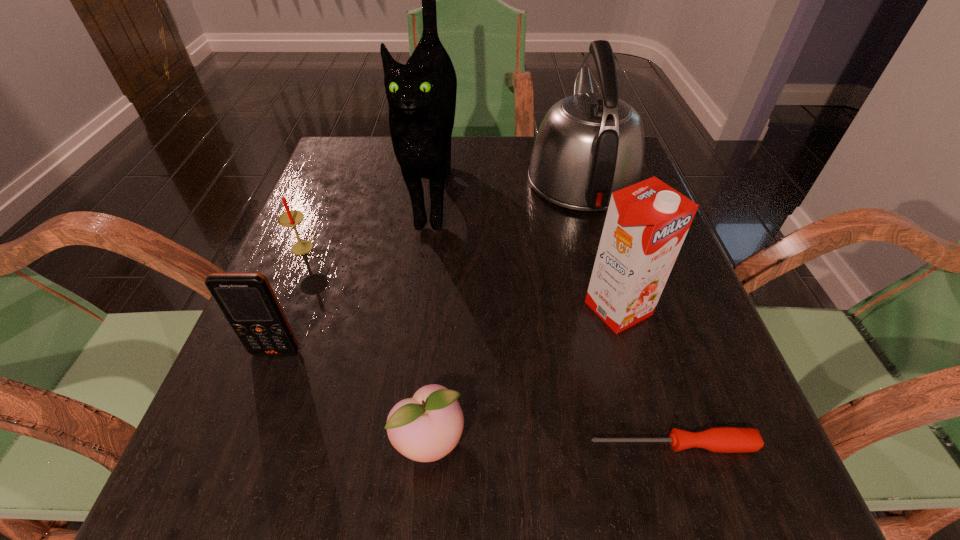
In order to click on screwdriver that is positioned at the near edge in this screenshot , I will do `click(720, 439)`.

I want to click on cellular telephone present at the left edge, so click(247, 300).

Where is `candle that is at the left edge`? candle that is at the left edge is located at coordinates (292, 218).

Identify the location of kettle at the right edge. Image resolution: width=960 pixels, height=540 pixels. (589, 145).

Identify the location of carton that is at the right edge. Image resolution: width=960 pixels, height=540 pixels. (646, 224).

Where is `screwdriver that is positioned at the right edge`? The width and height of the screenshot is (960, 540). screwdriver that is positioned at the right edge is located at coordinates (720, 439).

Identify the location of object located in the far right corner section of the desktop. The width and height of the screenshot is (960, 540). 589,145.

Where is `object located in the near right corner section of the desktop`? The height and width of the screenshot is (540, 960). object located in the near right corner section of the desktop is located at coordinates (720, 439).

Find the location of a particular element. vacant space at the far edge of the desktop is located at coordinates (483, 152).

Image resolution: width=960 pixels, height=540 pixels. Identify the location of vacant region at the near edge. (603, 492).